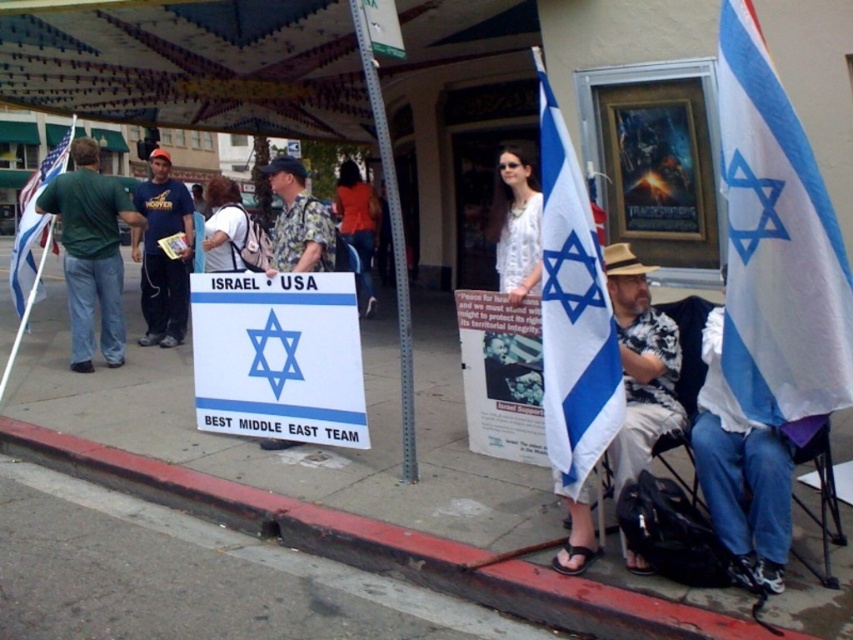
Between white lace shirt at center and printed fabric shirt at center, which one appears on the left side from the viewer's perspective?

printed fabric shirt at center is more to the left.

Which of these two, white lace shirt at center or printed fabric shirt at center, stands shorter?

Standing shorter between the two is printed fabric shirt at center.

Is point (506, 193) closer to camera compared to point (331, 236)?

Yes.

The height and width of the screenshot is (640, 853). I want to click on white lace shirt at center, so click(x=515, y=225).

Describe the element at coordinates (161, 252) in the screenshot. This screenshot has width=853, height=640. I see `matte blue t-shirt at center` at that location.

Is matte blue t-shirt at center to the left of white fabric flag at left from the viewer's perspective?

In fact, matte blue t-shirt at center is to the right of white fabric flag at left.

Who is more forward, (184, 268) or (22, 224)?

Positioned in front is point (22, 224).

This screenshot has height=640, width=853. Identify the location of matte blue t-shirt at center. (161, 252).

Measure the distance between point (3, 289) and camera.

They are 13.84 meters apart.

How distant is white concrete sidewalk at lower center from white fabric flag at right?

white concrete sidewalk at lower center is 8.29 feet away from white fabric flag at right.

Between point (62, 330) and point (763, 140), which one is positioned in front?

Point (763, 140) is more forward.

At what (x,y) coordinates should I click in order to perform the action: click on white concrete sidewalk at lower center. Please return your answer as a coordinate pair (x, y). Looking at the image, I should click on (302, 445).